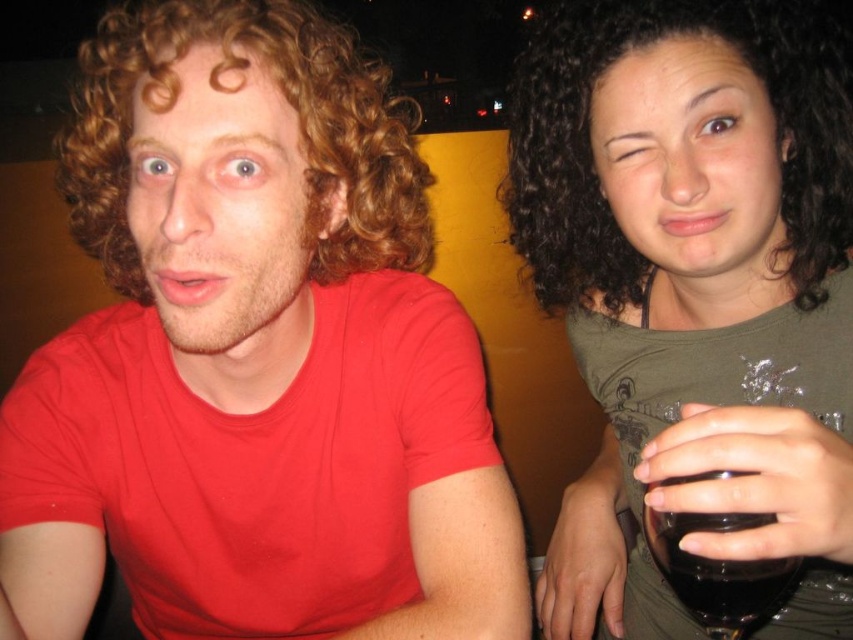
You are a photographer trying to capture a candid shot of the two people in the scene. You notice the matte red shirt at center and the curly brown hair at left. Which object takes up more visual space in the photo?

The curly brown hair at left takes up more visual space in the photo than the matte red shirt at center.

You are organizing a charity event and need to display two shirts on a mannequin. The matte red shirt at center and the green matte shirt at upper right. Which shirt should you choose if you want the one that is bigger?

The matte red shirt at center is larger in size compared to the green matte shirt at upper right, so you should choose the matte red shirt at center.

You are standing in front of this image and want to touch both points, point (282,428) and point (811,232). Which point should you reach for first if you want to touch the one closer to you first?

Point (282,428) is closer to you, so you should reach for it first.